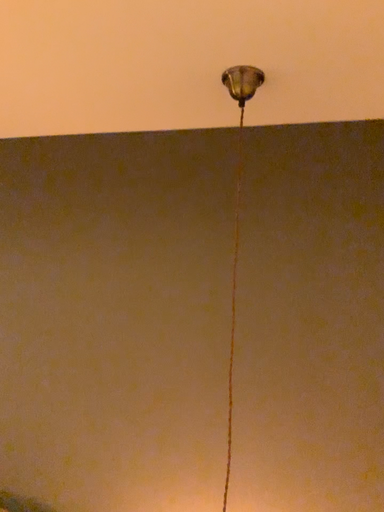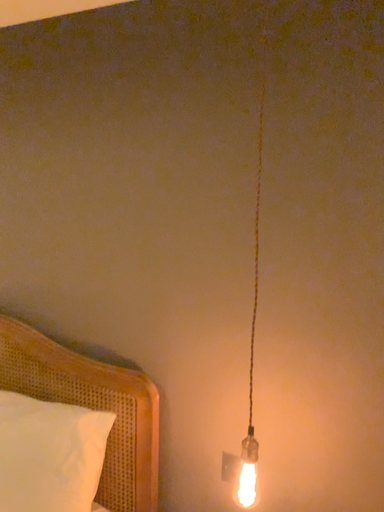
Question: How did the camera likely rotate when shooting the video?

Choices:
 (A) rotated upward
 (B) rotated downward

Answer: (B)